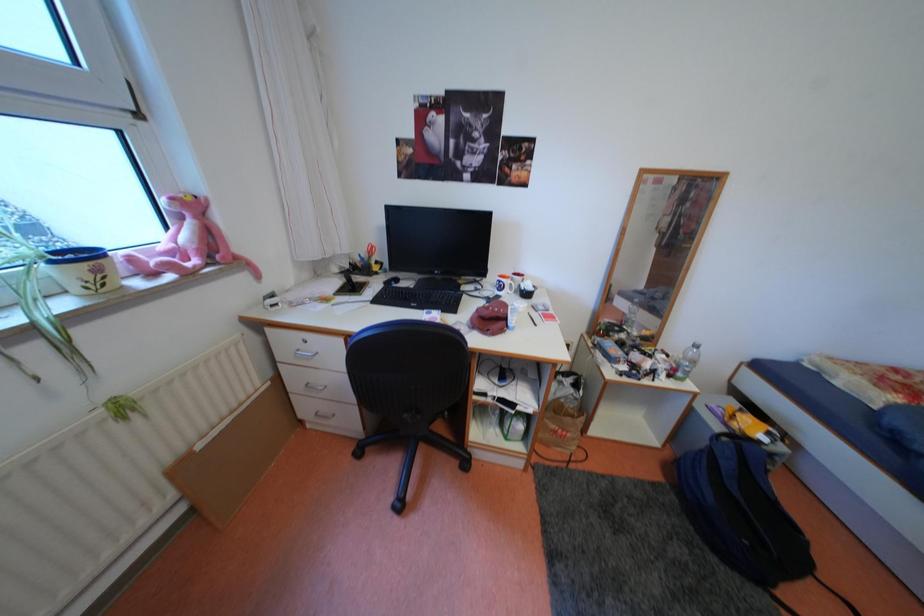
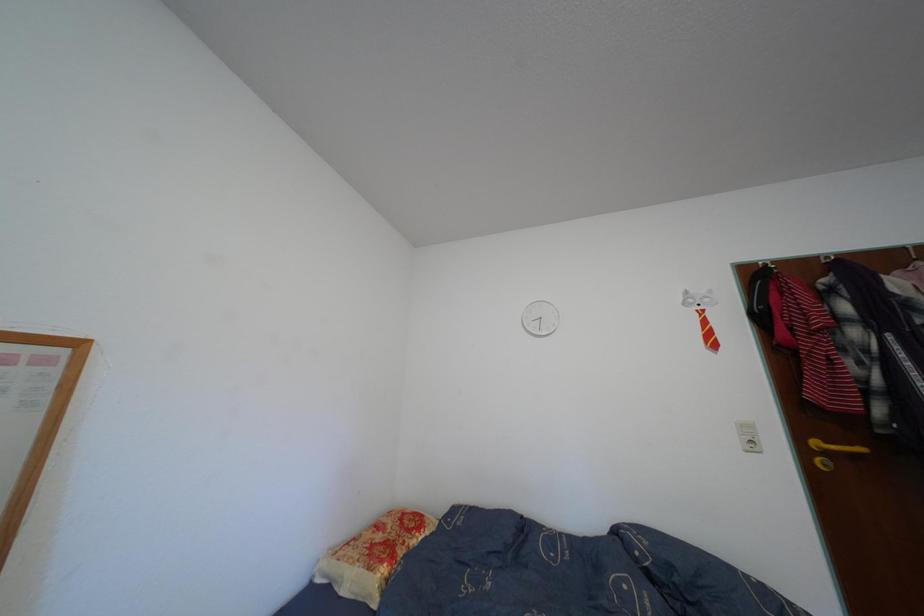
Consider the image. First-person continuous shooting, in which direction is the camera rotating?

The rotation direction of the camera is right-up.